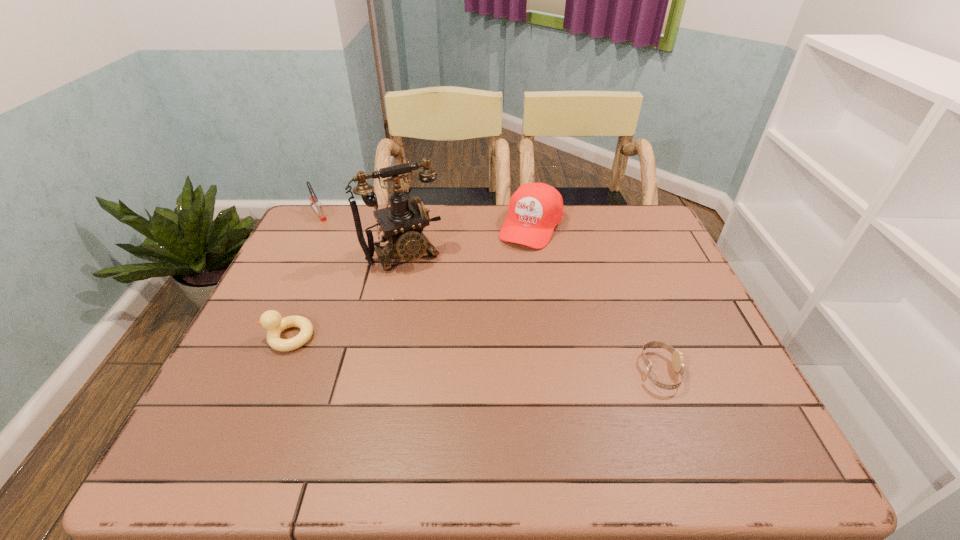
Locate an element on the screen. The height and width of the screenshot is (540, 960). vacant region at the left edge of the desktop is located at coordinates (259, 319).

In the image, there is a desktop. Identify the location of vacant region at the right edge. (670, 255).

Find the location of `free space at the far left corner of the desktop`. free space at the far left corner of the desktop is located at coordinates (334, 223).

In the image, there is a desktop. Where is `vacant space at the far right corner`? Image resolution: width=960 pixels, height=540 pixels. vacant space at the far right corner is located at coordinates (628, 242).

Where is `free spot at the near right corner of the desktop`? The height and width of the screenshot is (540, 960). free spot at the near right corner of the desktop is located at coordinates (700, 386).

Find the location of `vacant space that is in between the rightmost object and the second shortest object`. vacant space that is in between the rightmost object and the second shortest object is located at coordinates coord(474,354).

The height and width of the screenshot is (540, 960). Find the location of `free space between the rightmost object and the second shortest object`. free space between the rightmost object and the second shortest object is located at coordinates (474, 354).

Identify the location of free space between the fourth shortest object and the third object from right to left. (468, 240).

Find the location of a particular element. The width and height of the screenshot is (960, 540). vacant space in between the fourth tallest object and the third object from left to right is located at coordinates (347, 295).

This screenshot has height=540, width=960. Find the location of `vacant area that lies between the fourth object from left to right and the duckling`. vacant area that lies between the fourth object from left to right and the duckling is located at coordinates (410, 282).